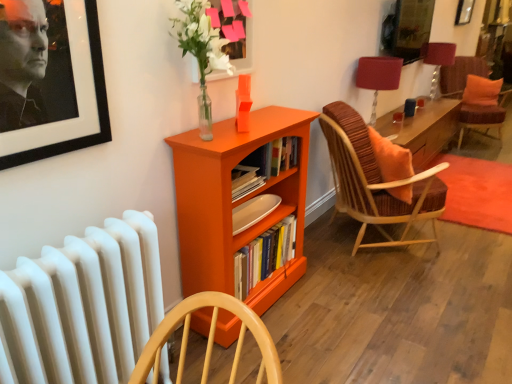
This screenshot has width=512, height=384. In order to click on vacant space that's between wooden woven chair with orange cushion at right, marked as the first chair in a bottom-to-top arrangement, and orange matte bookcase at center in this screenshot , I will do `click(342, 284)`.